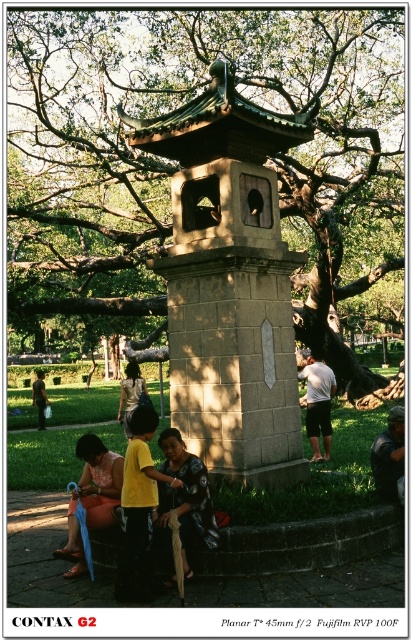
You are standing at the center of the park and see a point marked at coordinates (92,497). What object is located at that point?

The point at (92,497) marks the location of the matte orange dress at lower left.

You are a photographer trying to capture a clear shot of the yellow matte shirt at center and dark floral dress at center. Since you want both subjects in focus, which one should you adjust your camera focus closer to?

You should focus closer to the yellow matte shirt at center because the dark floral dress at center is behind it, meaning the yellow matte shirt at center is closer to the camera.

You are standing at the center of the park near the traditional stone lantern. You notice a matte orange dress at lower left. Where is the matte orange dress located relative to your position?

The matte orange dress at lower left is located at point 0.777 on the x axis and 0.224 on the y axis relative to your position at the center of the park.